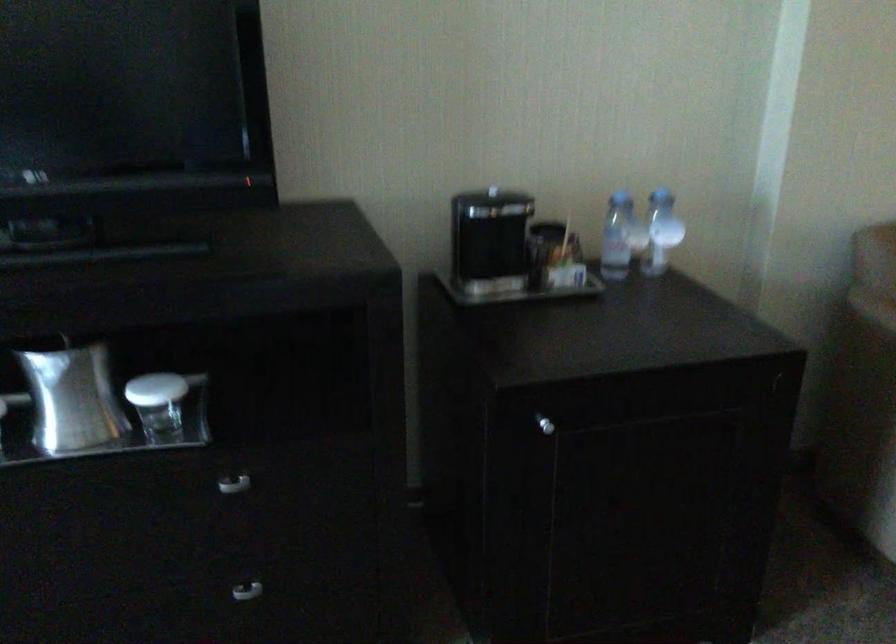
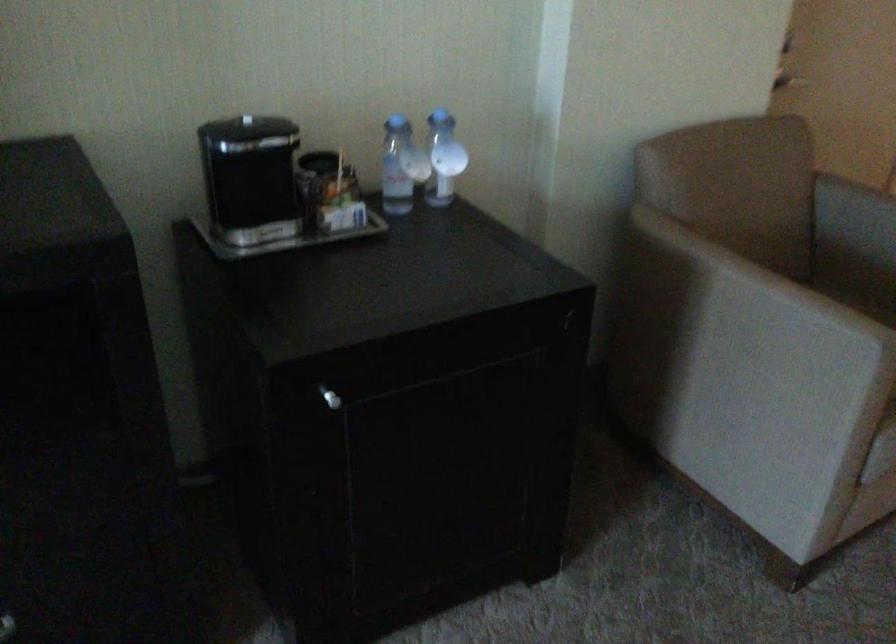
Where in the second image is the point corresponding to the point at 488,185 from the first image?

(246, 120)